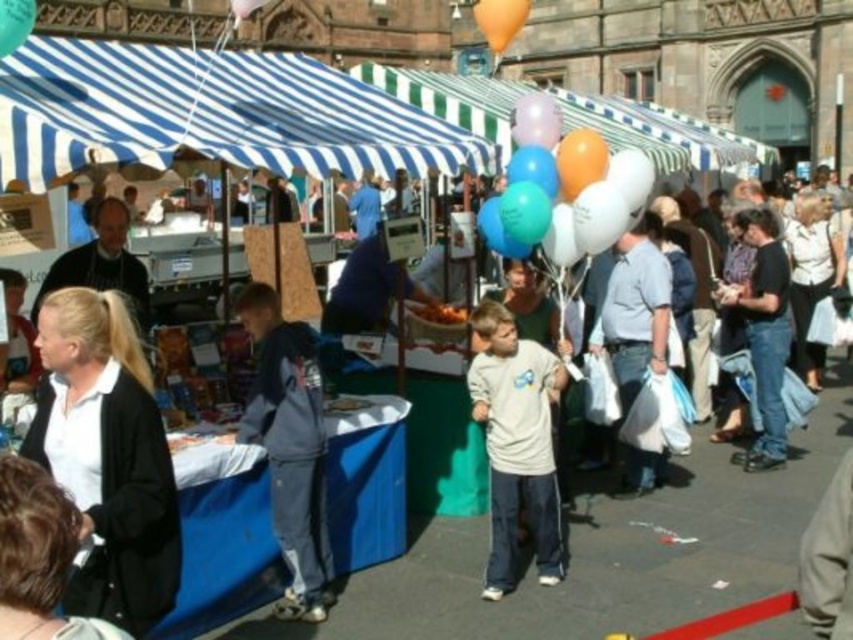
Which is behind, point (276, 300) or point (515, 499)?

The point (276, 300) is more distant.

I want to click on dark gray fleece jacket at center, so click(289, 445).

Does white matte jacket at lower left appear on the right side of orange matte balloon at upper center?

No, white matte jacket at lower left is not to the right of orange matte balloon at upper center.

Locate an element on the screen. This screenshot has height=640, width=853. white matte jacket at lower left is located at coordinates (107, 456).

What do you see at coordinates (107, 456) in the screenshot? The height and width of the screenshot is (640, 853). I see `white matte jacket at lower left` at bounding box center [107, 456].

Find the location of a particular element. The height and width of the screenshot is (640, 853). white matte jacket at lower left is located at coordinates (107, 456).

Measure the distance from orange matte balloon at upper center to matte green balloon at upper left.

orange matte balloon at upper center is 36.09 meters away from matte green balloon at upper left.

Which of these two, orange matte balloon at upper center or matte green balloon at upper left, stands shorter?

matte green balloon at upper left is shorter.

This screenshot has width=853, height=640. Identify the location of orange matte balloon at upper center. (498, 20).

The height and width of the screenshot is (640, 853). Find the location of `orange matte balloon at upper center`. orange matte balloon at upper center is located at coordinates (498, 20).